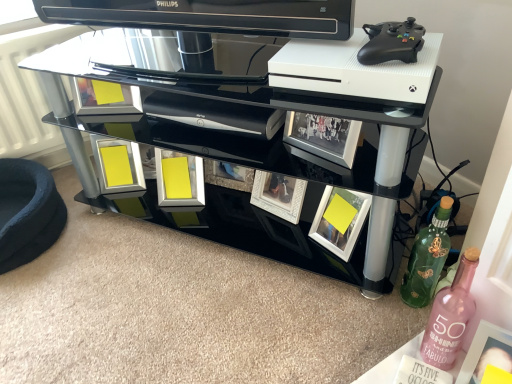
Identify the location of vacant space behind pink glass bottle at lower right, the 1th bottle when ordered from front to back. (389, 303).